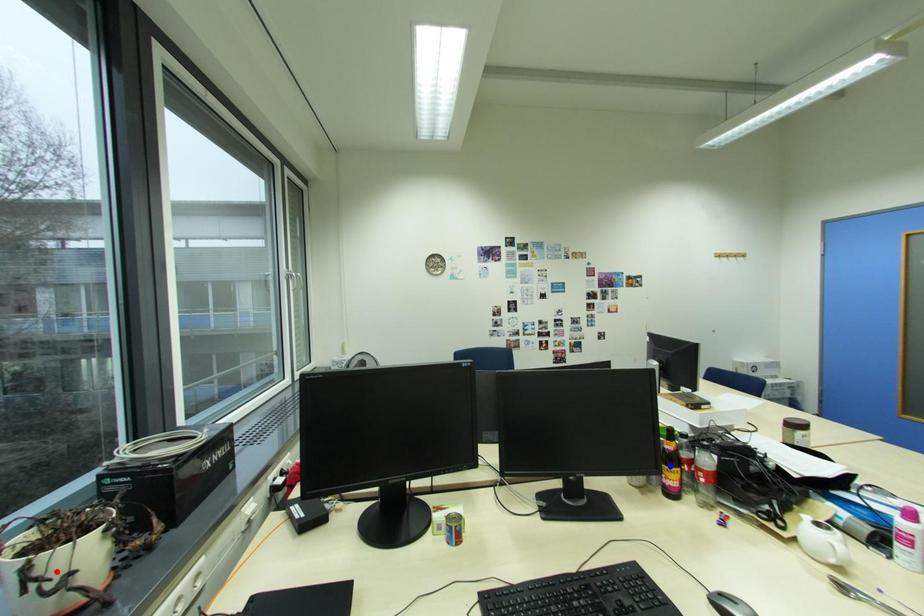
Question: Two points are marked on the image. Which point is closer to the camera?

Choices:
 (A) Blue point is closer.
 (B) Red point is closer.

Answer: (B)